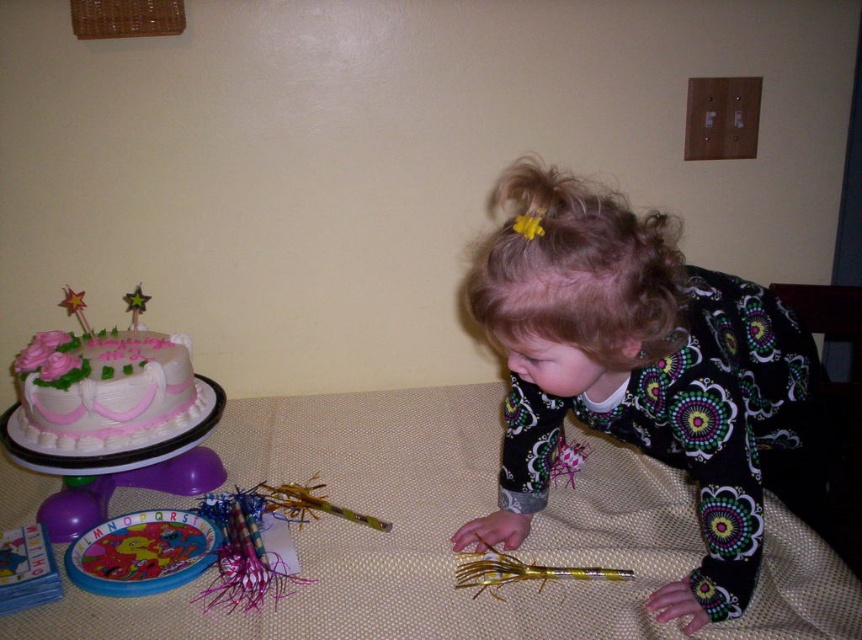
Does floral-patterned pajamas at lower right appear on the right side of pink frosted cake at left?

Correct, you'll find floral-patterned pajamas at lower right to the right of pink frosted cake at left.

Does floral-patterned pajamas at lower right appear on the left side of pink frosted cake at left?

In fact, floral-patterned pajamas at lower right is to the right of pink frosted cake at left.

Find the location of a particular element. Image resolution: width=862 pixels, height=640 pixels. floral-patterned pajamas at lower right is located at coordinates (644, 376).

Which is above, beige fabric table at lower center or floral-patterned pajamas at lower right?

floral-patterned pajamas at lower right is higher up.

Is beige fabric table at lower center bigger than floral-patterned pajamas at lower right?

Yes.

Is point (400, 541) positioned in front of point (650, 259)?

No, (400, 541) is further to viewer.

Where is `beige fabric table at lower center`? The image size is (862, 640). beige fabric table at lower center is located at coordinates pos(453,529).

Who is lower down, beige fabric table at lower center or pink frosted cake at left?

beige fabric table at lower center is below.

Is point (148, 492) positioned after point (92, 400)?

Yes, it is behind point (92, 400).

At what (x,y) coordinates should I click in order to perform the action: click on beige fabric table at lower center. Please return your answer as a coordinate pair (x, y). Image resolution: width=862 pixels, height=640 pixels. Looking at the image, I should click on coord(453,529).